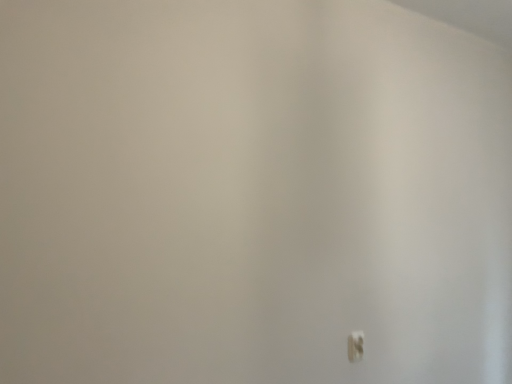
Find the location of a particular element. white matte power plugs and sockets at lower right is located at coordinates (355, 346).

Describe the element at coordinates (355, 346) in the screenshot. This screenshot has width=512, height=384. I see `white matte power plugs and sockets at lower right` at that location.

At what (x,y) coordinates should I click in order to perform the action: click on white matte power plugs and sockets at lower right. Please return your answer as a coordinate pair (x, y). The image size is (512, 384). Looking at the image, I should click on (355, 346).